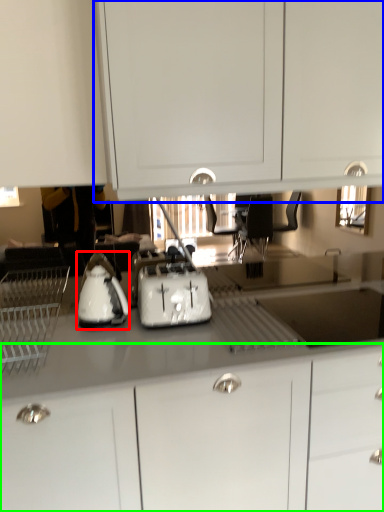
Question: Which object is the closest to the kitchen appliance (highlighted by a red box)? Choose among these: cabinetry (highlighted by a blue box) or cabinetry (highlighted by a green box).

Choices:
 (A) cabinetry
 (B) cabinetry

Answer: (B)